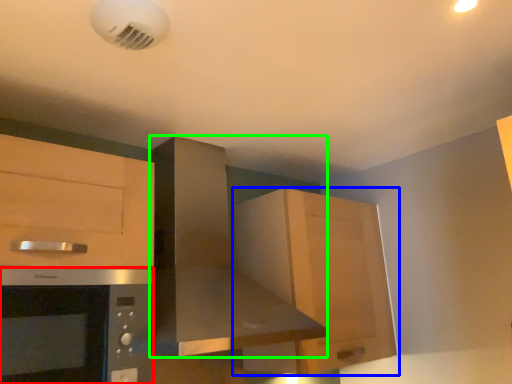
Question: Based on their relative distances, which object is nearer to microwave oven (highlighted by a red box)? Choose from cabinetry (highlighted by a blue box) and home appliance (highlighted by a green box).

Choices:
 (A) cabinetry
 (B) home appliance

Answer: (B)